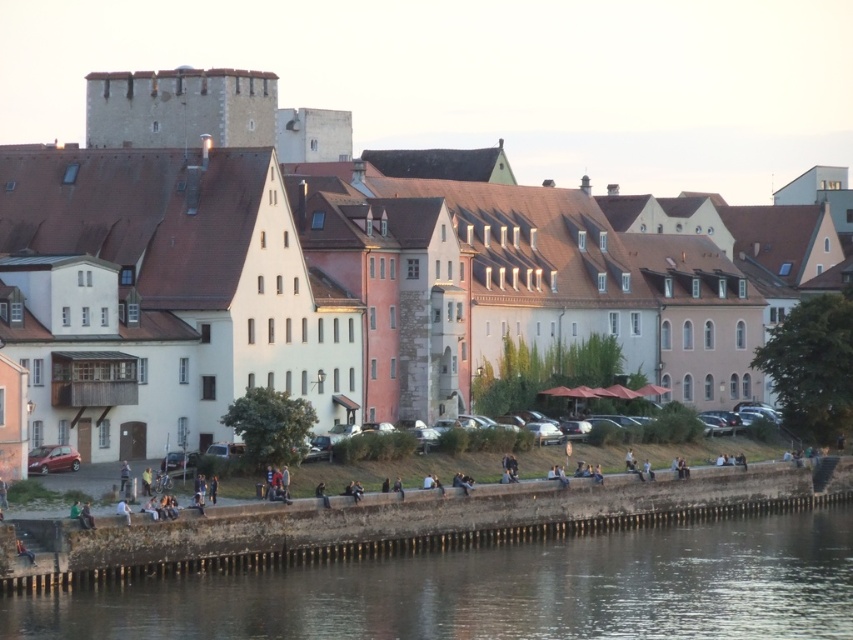
Question: Does white stone buildings at center appear over smooth concrete wall at lower center?

Choices:
 (A) no
 (B) yes

Answer: (B)

Question: Is white stone buildings at center positioned before smooth concrete wall at lower center?

Choices:
 (A) no
 (B) yes

Answer: (A)

Question: Among these points, which one is farthest from the camera?

Choices:
 (A) (160, 115)
 (B) (543, 589)

Answer: (A)

Question: Which point is farther to the camera?

Choices:
 (A) (234, 266)
 (B) (715, 620)

Answer: (A)

Question: Is white stone buildings at center to the right of smooth concrete wall at lower center from the viewer's perspective?

Choices:
 (A) no
 (B) yes

Answer: (A)